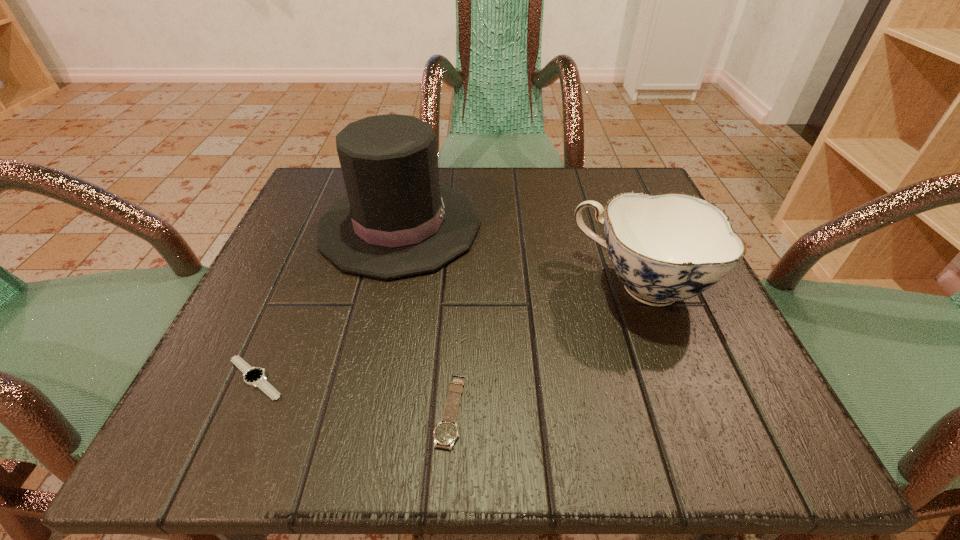
This screenshot has width=960, height=540. Identify the location of dress hat that is at the left edge. (397, 220).

The image size is (960, 540). In order to click on watch present at the left edge in this screenshot , I will do `click(254, 376)`.

The height and width of the screenshot is (540, 960). What are the coordinates of `object present at the right edge` in the screenshot? It's located at (667, 247).

Image resolution: width=960 pixels, height=540 pixels. I want to click on object that is at the far left corner, so click(397, 220).

Find the location of a particular element. This screenshot has width=960, height=540. object at the near left corner is located at coordinates (254, 376).

Where is `vacant region at the far edge of the desktop`? Image resolution: width=960 pixels, height=540 pixels. vacant region at the far edge of the desktop is located at coordinates (444, 169).

In the image, there is a desktop. Where is `vacant area at the near edge`? The width and height of the screenshot is (960, 540). vacant area at the near edge is located at coordinates (522, 430).

The image size is (960, 540). I want to click on vacant space at the left edge of the desktop, so click(x=293, y=267).

Identify the location of free space at the right edge. This screenshot has height=540, width=960. (638, 352).

Locate an element on the screen. free location at the far left corner is located at coordinates (312, 185).